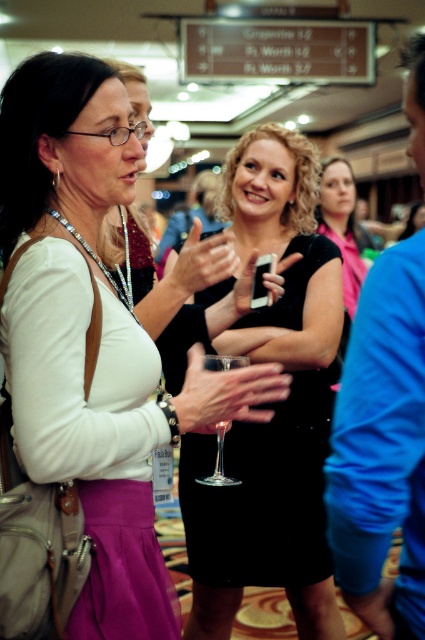
In the scene shown: You are a photographer at the event and want to take a photo of the black matte dress at center and the clear glass wine glass at center. Which object will appear closer to the camera in the photo?

The black matte dress at center will appear closer to the camera in the photo because it is positioned further to the viewer than the clear glass wine glass at center.

You are attending a formal event and need to choose between the white matte dress at center and the black matte dress at center. Based on their widths, which dress would allow for more comfortable movement?

The white matte dress at center is wider than the black matte dress at center, so it would allow for more comfortable movement.

You are at a social event and notice two dresses at the center of the scene. Which one is closer to you, the black satin dress at center or the black matte dress at center?

The black satin dress at center is closer to you because it is in front of the black matte dress at center.